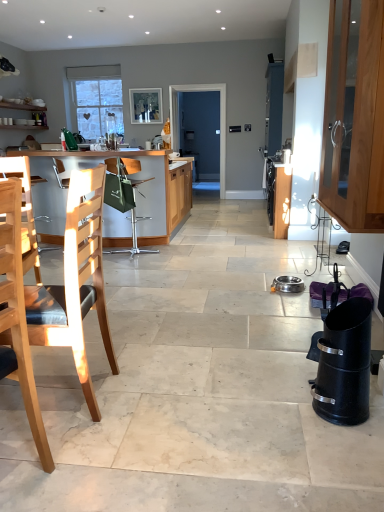
Find the location of a particular element. vacant area situated below light wood chair at left, which is counted as the 2th chair, starting from the front (from a real-world perspective) is located at coordinates (67, 397).